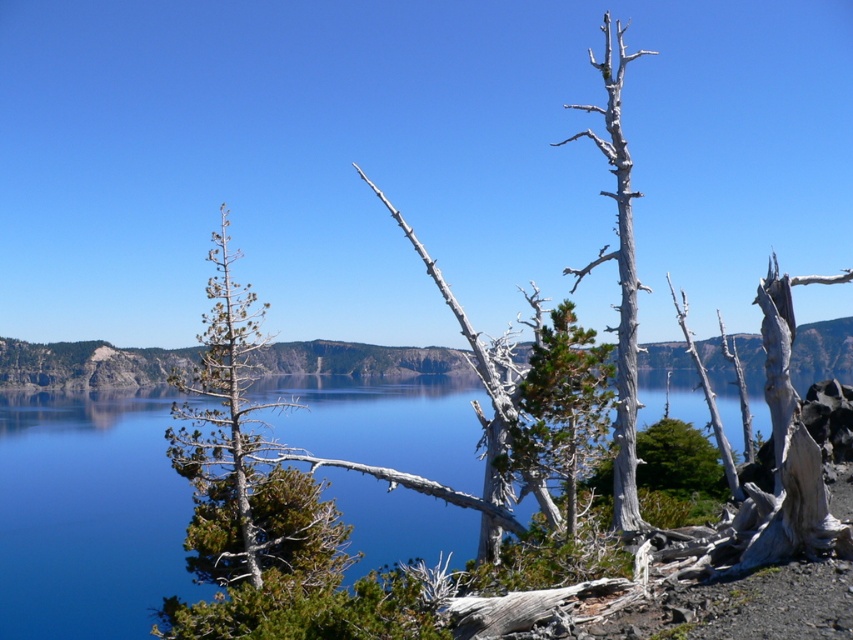
Does green matte tree at center have a smaller size compared to gray bark tree at upper center?

Yes.

The width and height of the screenshot is (853, 640). What are the coordinates of `green matte tree at center` in the screenshot? It's located at (561, 406).

Who is more forward, (521, 452) or (584, 106)?

Point (521, 452)

Where is `green matte tree at center`? This screenshot has height=640, width=853. green matte tree at center is located at coordinates (561, 406).

Is blue glassy water at center to the right of gray bark tree at upper center from the viewer's perspective?

No, blue glassy water at center is not to the right of gray bark tree at upper center.

Is point (367, 547) closer to viewer compared to point (625, 198)?

No, (367, 547) is further to viewer.

Image resolution: width=853 pixels, height=640 pixels. Find the location of `blue glassy water at center`. blue glassy water at center is located at coordinates (88, 513).

Does green textured pine tree at left have a greater width compared to gray bark tree at upper center?

No, green textured pine tree at left is not wider than gray bark tree at upper center.

Between point (207, 392) and point (614, 113), which one is positioned behind?

The point (614, 113) is more distant.

Where is `green textured pine tree at left`? Image resolution: width=853 pixels, height=640 pixels. green textured pine tree at left is located at coordinates (224, 433).